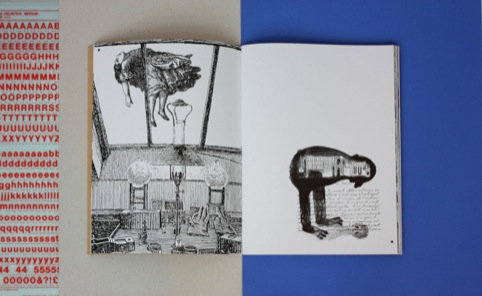
You are a GUI agent. You are given a task and a screenshot of the screen. Output one action in this format:
    pyautogui.click(x=<x>, y=<y>)
    Task: Click on the sticker sheet
    The width and height of the screenshot is (482, 296).
    Given the screenshot: What is the action you would take?
    pyautogui.click(x=25, y=69), pyautogui.click(x=18, y=220)